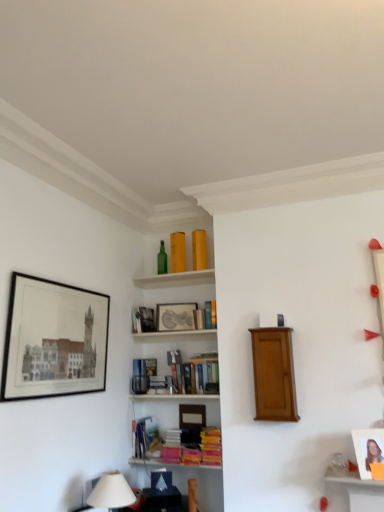
Identify the location of vacant space situated above mahogany wood cabinet at center (from a real-world perspective). The width and height of the screenshot is (384, 512). (269, 329).